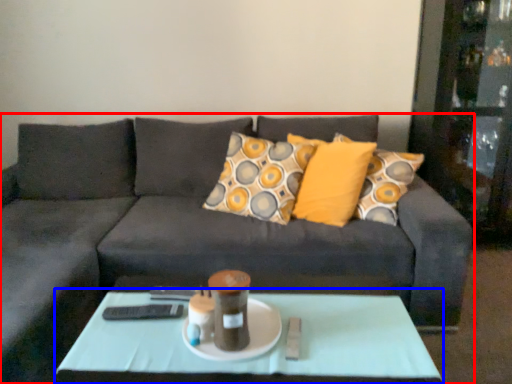
Question: Which object appears closest to the camera in this image, studio couch (highlighted by a red box) or coffee table (highlighted by a blue box)?

Choices:
 (A) studio couch
 (B) coffee table

Answer: (A)